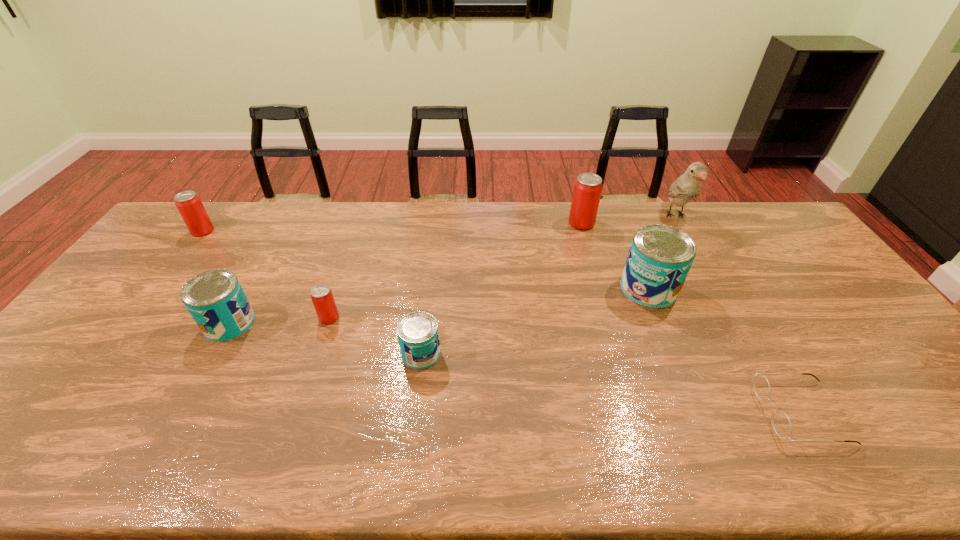
The height and width of the screenshot is (540, 960). Identify the location of the fourth object from left to right. (418, 335).

Locate an element on the screen. This screenshot has height=540, width=960. the third can from right to left is located at coordinates (418, 335).

I want to click on the nearest red can, so click(x=321, y=295).

Locate an element on the screen. Image resolution: width=960 pixels, height=540 pixels. the second red can from left to right is located at coordinates (321, 295).

The width and height of the screenshot is (960, 540). In order to click on spectacles in this screenshot , I will do `click(781, 423)`.

You are a GUI agent. You are given a task and a screenshot of the screen. Output one action in this format:
    pyautogui.click(x=<x>, y=<y>)
    Task: Click on the black spectacles
    
    Given the screenshot: What is the action you would take?
    pyautogui.click(x=781, y=423)

Image resolution: width=960 pixels, height=540 pixels. I want to click on vacant region located 0.060m at the face of the tallest object, so click(691, 244).

This screenshot has width=960, height=540. In order to click on vacant space situated on the left of the rightmost blue can in this screenshot , I will do `click(535, 288)`.

Where is `vacant region located 0.090m on the left of the rightmost red can`? This screenshot has height=540, width=960. vacant region located 0.090m on the left of the rightmost red can is located at coordinates (543, 223).

This screenshot has height=540, width=960. I want to click on vacant space situated 0.360m on the right of the second smallest red can, so click(316, 231).